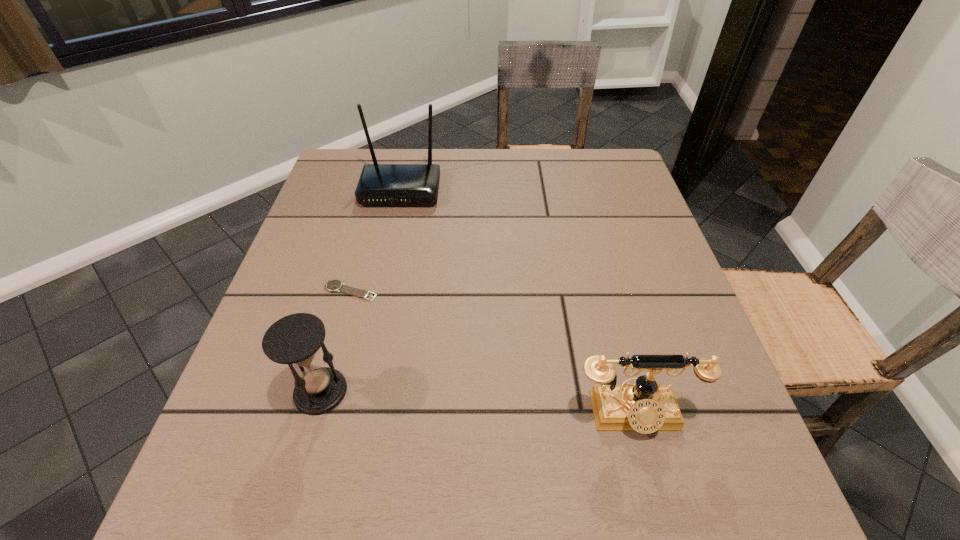
Where is `empty location between the watch and the hourglass`? This screenshot has width=960, height=540. empty location between the watch and the hourglass is located at coordinates (335, 341).

Identify the location of vacant area that lies between the watch and the telephone. This screenshot has width=960, height=540. (492, 353).

Identify the location of vacant space in between the watch and the hourglass. This screenshot has width=960, height=540. (335, 341).

Identify the location of vacant point located between the rightmost object and the tallest object. (516, 302).

Find the location of a particular element. The image size is (960, 540). free space between the watch and the rightmost object is located at coordinates (492, 353).

Where is `free space between the farthest object and the telephone`? free space between the farthest object and the telephone is located at coordinates (516, 302).

The height and width of the screenshot is (540, 960). Identify the location of vacant space in between the hourglass and the rightmost object. (477, 403).

Identify which object is located as the third nearest to the hourglass. Please provide its 2D coordinates. Your answer should be formatted as a tuple, i.e. [(x, y)], where the tuple contains the x and y coordinates of a point satisfying the conditions above.

[(379, 184)]

Choose which object is the second nearest neighbor to the hourglass. Please provide its 2D coordinates. Your answer should be formatted as a tuple, i.e. [(x, y)], where the tuple contains the x and y coordinates of a point satisfying the conditions above.

[(645, 407)]